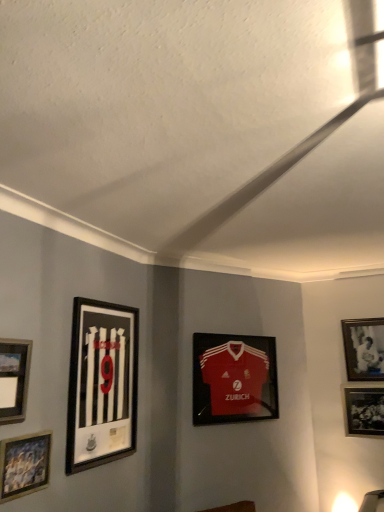
The image size is (384, 512). Describe the element at coordinates (363, 410) in the screenshot. I see `black matte photo frame at lower right, which ranks as the 5th picture frame in left-to-right order` at that location.

This screenshot has width=384, height=512. Find the location of `matte silver picture frame at lower left, the sixth picture frame when ordered from right to left`. matte silver picture frame at lower left, the sixth picture frame when ordered from right to left is located at coordinates point(14,379).

How much space does matte silver picture frame at lower left, the sixth picture frame when ordered from right to left, occupy horizontally?

matte silver picture frame at lower left, the sixth picture frame when ordered from right to left, is 3.54 centimeters in width.

At what (x,y) coordinates should I click in order to perform the action: click on black matte picture frame at left, positioned as the 3th picture frame in left-to-right order. Please return your answer as a coordinate pair (x, y). The height and width of the screenshot is (512, 384). Looking at the image, I should click on (102, 384).

You are a GUI agent. You are given a task and a screenshot of the screen. Output one action in this format:
    pyautogui.click(x=<x>, y=<y>)
    Task: Click on the matte plastic picture frame at center, which is counted as the 3th picture frame, starting from the right
    The image size is (384, 512).
    Given the screenshot: What is the action you would take?
    pyautogui.click(x=234, y=378)

Which object is further away from the camera taking this photo, black matte photo frame at lower right, which ranks as the 5th picture frame in left-to-right order, or matte silver picture frame at lower left, the first picture frame when ordered from left to right?

black matte photo frame at lower right, which ranks as the 5th picture frame in left-to-right order.

Which is in front, point (375, 421) or point (24, 415)?

The point (24, 415) is in front.

Locate an element on the screen. the 4th picture frame in front when counting from the black matte photo frame at lower right, which ranks as the 5th picture frame in left-to-right order is located at coordinates (14, 379).

Is black matte photo frame at lower right, which ranks as the 5th picture frame in left-to-right order, placed right next to matte silver picture frame at lower left, the sixth picture frame when ordered from right to left?

There is a gap between black matte photo frame at lower right, which ranks as the 5th picture frame in left-to-right order, and matte silver picture frame at lower left, the sixth picture frame when ordered from right to left.

Considering the relative positions of white matte picture frame at upper right, arranged as the 6th picture frame when viewed from the left, and matte plastic picture frame at center, which is counted as the 3th picture frame, starting from the right, in the image provided, is white matte picture frame at upper right, arranged as the 6th picture frame when viewed from the left, to the right of matte plastic picture frame at center, which is counted as the 3th picture frame, starting from the right, from the viewer's perspective?

Indeed, white matte picture frame at upper right, arranged as the 6th picture frame when viewed from the left, is positioned on the right side of matte plastic picture frame at center, which is counted as the 3th picture frame, starting from the right.

Is white matte picture frame at upper right, arranged as the 6th picture frame when viewed from the left, positioned beyond the bounds of matte plastic picture frame at center, which is counted as the 3th picture frame, starting from the right?

Yes, white matte picture frame at upper right, arranged as the 6th picture frame when viewed from the left, is not within matte plastic picture frame at center, which is counted as the 3th picture frame, starting from the right.

In order to click on the 2nd picture frame to the left when counting from the white matte picture frame at upper right, arranged as the 6th picture frame when viewed from the left in this screenshot , I will do `click(234, 378)`.

Which object is thinner, matte plastic picture frame at center, which is counted as the 3th picture frame, starting from the right, or black matte photo frame at lower right, which ranks as the 5th picture frame in left-to-right order?

black matte photo frame at lower right, which ranks as the 5th picture frame in left-to-right order.

Is matte plastic picture frame at center, acting as the 4th picture frame starting from the left, positioned beyond the bounds of black matte photo frame at lower right, which ranks as the 5th picture frame in left-to-right order?

Yes, matte plastic picture frame at center, acting as the 4th picture frame starting from the left, is located beyond the bounds of black matte photo frame at lower right, which ranks as the 5th picture frame in left-to-right order.

Which is more to the right, matte plastic picture frame at center, acting as the 4th picture frame starting from the left, or black matte photo frame at lower right, placed as the second picture frame when sorted from right to left?

black matte photo frame at lower right, placed as the second picture frame when sorted from right to left.

Are matte plastic picture frame at center, which is counted as the 3th picture frame, starting from the right, and black matte photo frame at lower right, placed as the second picture frame when sorted from right to left, far apart?

They are positioned close to each other.

Considering the sizes of black matte picture frame at left, the 4th picture frame in the right-to-left sequence, and wooden picture frame at lower left, acting as the fifth picture frame starting from the right, in the image, is black matte picture frame at left, the 4th picture frame in the right-to-left sequence, taller or shorter than wooden picture frame at lower left, acting as the fifth picture frame starting from the right,?

In the image, black matte picture frame at left, the 4th picture frame in the right-to-left sequence, appears to be taller than wooden picture frame at lower left, acting as the fifth picture frame starting from the right.

Considering the relative sizes of black matte picture frame at left, positioned as the 3th picture frame in left-to-right order, and wooden picture frame at lower left, which is the second picture frame in left-to-right order, in the image provided, is black matte picture frame at left, positioned as the 3th picture frame in left-to-right order, smaller than wooden picture frame at lower left, which is the second picture frame in left-to-right order,?

No, black matte picture frame at left, positioned as the 3th picture frame in left-to-right order, is not smaller than wooden picture frame at lower left, which is the second picture frame in left-to-right order.

Which point is more forward, (91,354) or (15,461)?

The point (15,461) is more forward.

How different are the orientations of black matte picture frame at left, the 4th picture frame in the right-to-left sequence, and wooden picture frame at lower left, which is the second picture frame in left-to-right order, in degrees?

black matte picture frame at left, the 4th picture frame in the right-to-left sequence, and wooden picture frame at lower left, which is the second picture frame in left-to-right order, are facing 0.00428 degrees away from each other.

Between white matte picture frame at upper right, which is the 1th picture frame from right to left, and black matte picture frame at left, positioned as the 3th picture frame in left-to-right order, which one appears on the right side from the viewer's perspective?

white matte picture frame at upper right, which is the 1th picture frame from right to left, is more to the right.

Based on the photo, is white matte picture frame at upper right, arranged as the 6th picture frame when viewed from the left, not close to black matte picture frame at left, positioned as the 3th picture frame in left-to-right order?

white matte picture frame at upper right, arranged as the 6th picture frame when viewed from the left, is positioned a significant distance from black matte picture frame at left, positioned as the 3th picture frame in left-to-right order.

From the image's perspective, which is above, white matte picture frame at upper right, arranged as the 6th picture frame when viewed from the left, or black matte picture frame at left, positioned as the 3th picture frame in left-to-right order?

black matte picture frame at left, positioned as the 3th picture frame in left-to-right order, appears higher in the image.

Is white matte picture frame at upper right, which is the 1th picture frame from right to left, turned away from black matte picture frame at left, the 4th picture frame in the right-to-left sequence?

No, white matte picture frame at upper right, which is the 1th picture frame from right to left, is not facing the opposite direction of black matte picture frame at left, the 4th picture frame in the right-to-left sequence.

From the image's perspective, which one is positioned higher, matte silver picture frame at lower left, the first picture frame when ordered from left to right, or wooden picture frame at lower left, which is the second picture frame in left-to-right order?

matte silver picture frame at lower left, the first picture frame when ordered from left to right, is shown above in the image.

From the picture: Is matte silver picture frame at lower left, the sixth picture frame when ordered from right to left, not within wooden picture frame at lower left, acting as the fifth picture frame starting from the right?

Yes, matte silver picture frame at lower left, the sixth picture frame when ordered from right to left, is outside of wooden picture frame at lower left, acting as the fifth picture frame starting from the right.

Does matte silver picture frame at lower left, the sixth picture frame when ordered from right to left, lie behind wooden picture frame at lower left, which is the second picture frame in left-to-right order?

No, matte silver picture frame at lower left, the sixth picture frame when ordered from right to left, is closer to the viewer.

Where is `the 4th picture frame below the matte silver picture frame at lower left, the sixth picture frame when ordered from right to left (from a real-world perspective)`? Image resolution: width=384 pixels, height=512 pixels. the 4th picture frame below the matte silver picture frame at lower left, the sixth picture frame when ordered from right to left (from a real-world perspective) is located at coordinates (24, 465).

Based on their positions, is matte silver picture frame at lower left, the first picture frame when ordered from left to right, located to the left or right of white matte picture frame at upper right, which is the 1th picture frame from right to left?

matte silver picture frame at lower left, the first picture frame when ordered from left to right, is positioned on white matte picture frame at upper right, which is the 1th picture frame from right to left,'s left side.

The height and width of the screenshot is (512, 384). In order to click on picture frame that is the 1st object directly below the white matte picture frame at upper right, arranged as the 6th picture frame when viewed from the left (from a real-world perspective) in this screenshot , I will do `click(14, 379)`.

What's the angular difference between matte silver picture frame at lower left, the sixth picture frame when ordered from right to left, and white matte picture frame at upper right, arranged as the 6th picture frame when viewed from the left,'s facing directions?

90.4 degrees.

Can you confirm if matte silver picture frame at lower left, the sixth picture frame when ordered from right to left, is wider than white matte picture frame at upper right, which is the 1th picture frame from right to left?

Yes.

From a real-world perspective, which picture frame is the 3rd one above the black matte photo frame at lower right, which ranks as the 5th picture frame in left-to-right order? Please provide its 2D coordinates.

[(14, 379)]

You are a GUI agent. You are given a task and a screenshot of the screen. Output one action in this format:
    pyautogui.click(x=<x>, y=<y>)
    Task: Click on the 2nd picture frame counting from the left side of the white matte picture frame at upper right, which is the 1th picture frame from right to left
    The height and width of the screenshot is (512, 384).
    Given the screenshot: What is the action you would take?
    pyautogui.click(x=234, y=378)

Which object lies nearer to the anchor point black matte photo frame at lower right, placed as the second picture frame when sorted from right to left, white matte picture frame at upper right, arranged as the 6th picture frame when viewed from the left, or matte silver picture frame at lower left, the first picture frame when ordered from left to right?

white matte picture frame at upper right, arranged as the 6th picture frame when viewed from the left.

When comparing their distances from black matte photo frame at lower right, placed as the second picture frame when sorted from right to left, does matte plastic picture frame at center, acting as the 4th picture frame starting from the left, or white matte picture frame at upper right, which is the 1th picture frame from right to left, seem further?

Among the two, matte plastic picture frame at center, acting as the 4th picture frame starting from the left, is located further to black matte photo frame at lower right, placed as the second picture frame when sorted from right to left.

Which object lies further to the anchor point matte silver picture frame at lower left, the sixth picture frame when ordered from right to left, wooden picture frame at lower left, acting as the fifth picture frame starting from the right, or matte plastic picture frame at center, which is counted as the 3th picture frame, starting from the right?

matte plastic picture frame at center, which is counted as the 3th picture frame, starting from the right, lies further to matte silver picture frame at lower left, the sixth picture frame when ordered from right to left, than the other object.

Looking at the image, which one is located further to black matte photo frame at lower right, which ranks as the 5th picture frame in left-to-right order, matte plastic picture frame at center, which is counted as the 3th picture frame, starting from the right, or matte silver picture frame at lower left, the sixth picture frame when ordered from right to left?

matte silver picture frame at lower left, the sixth picture frame when ordered from right to left, lies further to black matte photo frame at lower right, which ranks as the 5th picture frame in left-to-right order, than the other object.

Estimate the real-world distances between objects in this image. Which object is closer to matte plastic picture frame at center, acting as the 4th picture frame starting from the left, black matte photo frame at lower right, placed as the second picture frame when sorted from right to left, or white matte picture frame at upper right, arranged as the 6th picture frame when viewed from the left?

black matte photo frame at lower right, placed as the second picture frame when sorted from right to left, is positioned closer to the anchor matte plastic picture frame at center, acting as the 4th picture frame starting from the left.

Looking at the image, which one is located closer to black matte picture frame at left, the 4th picture frame in the right-to-left sequence, wooden picture frame at lower left, which is the second picture frame in left-to-right order, or black matte photo frame at lower right, which ranks as the 5th picture frame in left-to-right order?

Among the two, wooden picture frame at lower left, which is the second picture frame in left-to-right order, is located nearer to black matte picture frame at left, the 4th picture frame in the right-to-left sequence.

Which object lies further to the anchor point wooden picture frame at lower left, acting as the fifth picture frame starting from the right, matte silver picture frame at lower left, the sixth picture frame when ordered from right to left, or black matte photo frame at lower right, placed as the second picture frame when sorted from right to left?

Based on the image, black matte photo frame at lower right, placed as the second picture frame when sorted from right to left, appears to be further to wooden picture frame at lower left, acting as the fifth picture frame starting from the right.

Considering their positions, is matte plastic picture frame at center, acting as the 4th picture frame starting from the left, positioned closer to matte silver picture frame at lower left, the first picture frame when ordered from left to right, than white matte picture frame at upper right, which is the 1th picture frame from right to left?

Among the two, matte plastic picture frame at center, acting as the 4th picture frame starting from the left, is located nearer to matte silver picture frame at lower left, the first picture frame when ordered from left to right.

At what (x,y) coordinates should I click in order to perform the action: click on picture frame situated between matte plastic picture frame at center, acting as the 4th picture frame starting from the left, and white matte picture frame at upper right, arranged as the 6th picture frame when viewed from the left, from left to right. Please return your answer as a coordinate pair (x, y). The width and height of the screenshot is (384, 512). Looking at the image, I should click on (363, 410).

Identify the location of picture frame between matte silver picture frame at lower left, the sixth picture frame when ordered from right to left, and black matte picture frame at left, positioned as the 3th picture frame in left-to-right order, in the front-back direction. (24, 465).

In order to click on picture frame positioned between wooden picture frame at lower left, which is the second picture frame in left-to-right order, and matte plastic picture frame at center, which is counted as the 3th picture frame, starting from the right, from near to far in this screenshot , I will do `click(102, 384)`.

Identify the location of picture frame situated between black matte picture frame at left, positioned as the 3th picture frame in left-to-right order, and black matte photo frame at lower right, placed as the second picture frame when sorted from right to left, from left to right. pos(234,378).